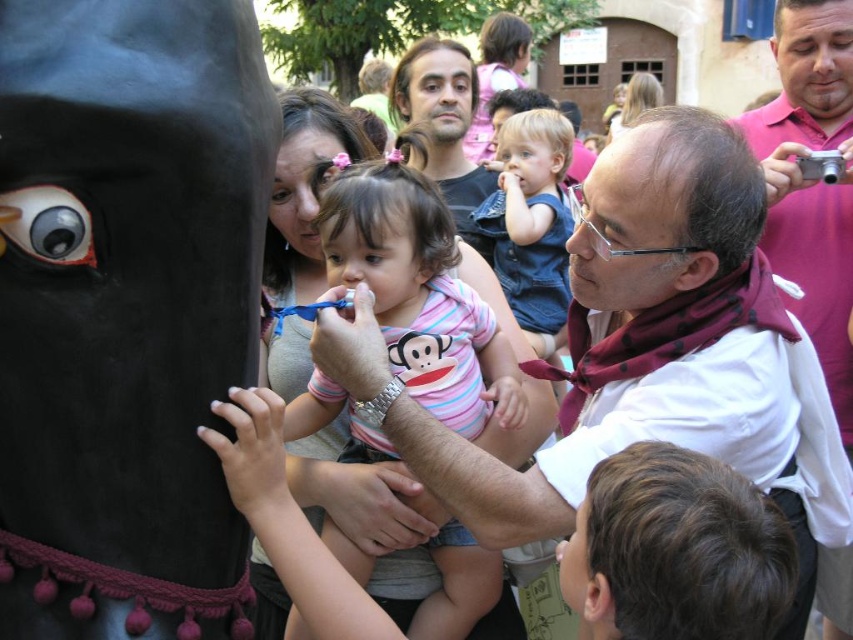
Question: Which of these objects is positioned closest to the denim shirt at center?

Choices:
 (A) pink cotton shirt at right
 (B) white shirt at center

Answer: (A)

Question: Which of the following is the farthest from the observer?

Choices:
 (A) (468, 108)
 (B) (534, 348)
 (C) (848, 228)
 (D) (466, 570)

Answer: (A)

Question: Can you confirm if white shirt at center is bigger than pink cotton shirt at right?

Choices:
 (A) yes
 (B) no

Answer: (B)

Question: Can you confirm if white shirt at center is positioned to the left of denim shirt at center?

Choices:
 (A) no
 (B) yes

Answer: (B)

Question: Estimate the real-world distances between objects in this image. Which object is farther from the denim shirt at center?

Choices:
 (A) matte black shirt at center
 (B) pink cotton shirt at right
 (C) white shirt at center

Answer: (C)

Question: Can you confirm if striped cotton onesie at center is wider than pink cotton shirt at right?

Choices:
 (A) yes
 (B) no

Answer: (B)